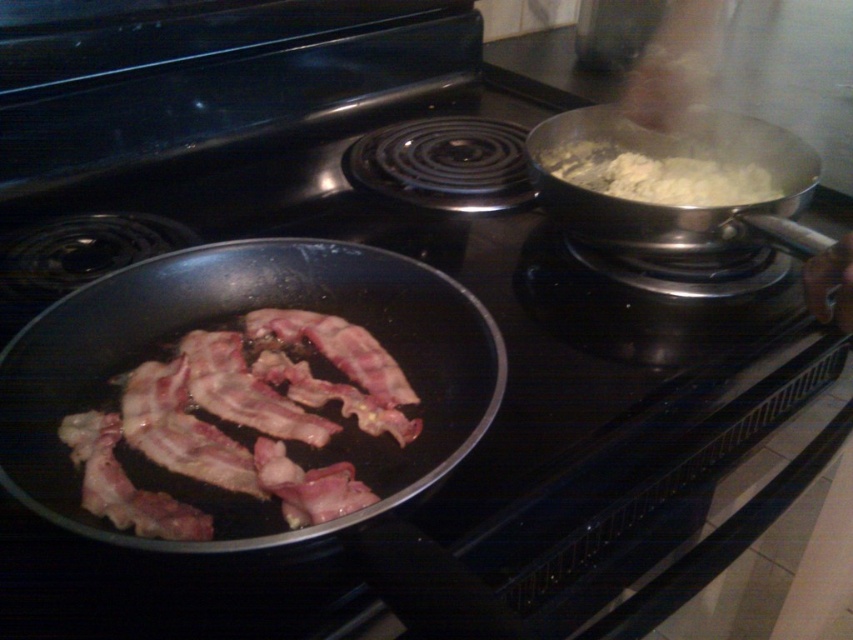
Question: Which point is closer to the camera?

Choices:
 (A) slightly browned metal pan at center
 (B) white matte pan at upper right
 (C) white fluffy food at upper right

Answer: (A)

Question: Does slightly browned metal pan at center appear on the left side of white matte pan at upper right?

Choices:
 (A) no
 (B) yes

Answer: (B)

Question: Which of the following is the farthest from the observer?

Choices:
 (A) (454, 397)
 (B) (743, 180)

Answer: (B)

Question: Is white matte pan at upper right thinner than white fluffy food at upper right?

Choices:
 (A) no
 (B) yes

Answer: (A)

Question: Which point is farther from the camera taking this photo?

Choices:
 (A) (263, 531)
 (B) (775, 221)
 (C) (733, 198)

Answer: (C)

Question: In this image, where is white matte pan at upper right located relative to white fluffy food at upper right?

Choices:
 (A) above
 (B) below

Answer: (B)